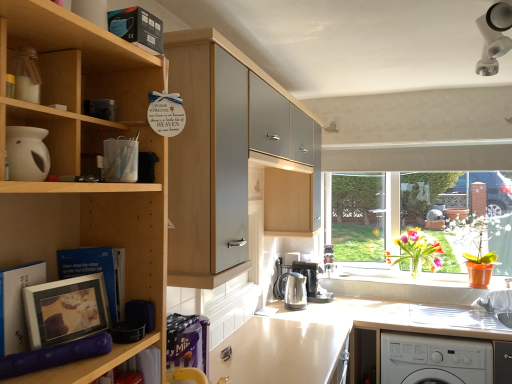
Question: Considering the relative positions of light brown laminate counter top at center and orange plastic pot at window in the image provided, is light brown laminate counter top at center behind orange plastic pot at window?

Choices:
 (A) yes
 (B) no

Answer: (B)

Question: Does light brown laminate counter top at center have a greater width compared to orange plastic pot at window?

Choices:
 (A) no
 (B) yes

Answer: (B)

Question: From a real-world perspective, is light brown laminate counter top at center located beneath orange plastic pot at window?

Choices:
 (A) yes
 (B) no

Answer: (A)

Question: Does light brown laminate counter top at center appear on the left side of orange plastic pot at window?

Choices:
 (A) yes
 (B) no

Answer: (A)

Question: Is light brown laminate counter top at center outside of orange plastic pot at window?

Choices:
 (A) yes
 (B) no

Answer: (A)

Question: Is satin black coffee machine at lower center wider or thinner than orange plastic pot at window?

Choices:
 (A) wide
 (B) thin

Answer: (A)

Question: Is satin black coffee machine at lower center situated inside orange plastic pot at window or outside?

Choices:
 (A) inside
 (B) outside

Answer: (B)

Question: From a real-world perspective, relative to orange plastic pot at window, is satin black coffee machine at lower center vertically above or below?

Choices:
 (A) above
 (B) below

Answer: (B)

Question: Is point (311, 284) closer or farther from the camera than point (470, 279)?

Choices:
 (A) closer
 (B) farther

Answer: (B)

Question: Is orange plastic pot at lower center in front of or behind orange plastic pot at window in the image?

Choices:
 (A) behind
 (B) front

Answer: (A)

Question: In the image, is orange plastic pot at lower center on the left side or the right side of orange plastic pot at window?

Choices:
 (A) left
 (B) right

Answer: (A)

Question: Is orange plastic pot at lower center taller or shorter than orange plastic pot at window?

Choices:
 (A) tall
 (B) short

Answer: (B)

Question: Which is correct: orange plastic pot at lower center is inside orange plastic pot at window, or outside of it?

Choices:
 (A) outside
 (B) inside

Answer: (A)

Question: In terms of size, does light brown laminate counter top at center appear bigger or smaller than matte silver picture frame at left?

Choices:
 (A) small
 (B) big

Answer: (B)

Question: In the image, is light brown laminate counter top at center on the left side or the right side of matte silver picture frame at left?

Choices:
 (A) right
 (B) left

Answer: (A)